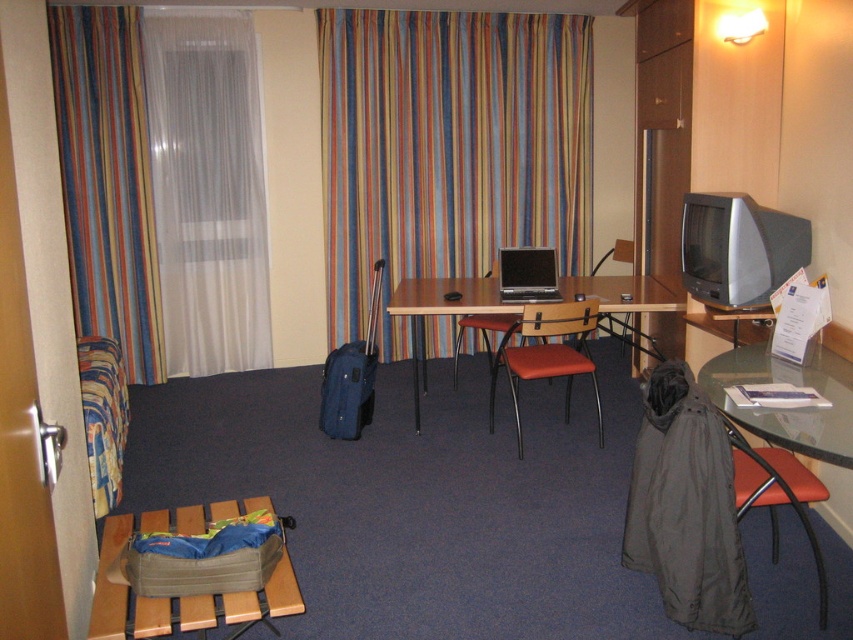
You are a guest in the room and want to hang a large painting on the wall behind the striped fabric curtain at center and wooden table at center. Which object should you move to make space? Explain your reasoning.

The striped fabric curtain at center should be moved because it has a larger size compared to the wooden table at center, so moving it would create more space for the painting.

You are trying to decide whether to place a large painting on the wall near the white sheer curtain at left or the transparent glass table at lower right. Based on their widths, which location has more space available?

The transparent glass table at lower right has a greater width than the white sheer curtain at left, so placing the large painting near the transparent glass table at lower right would provide more space.